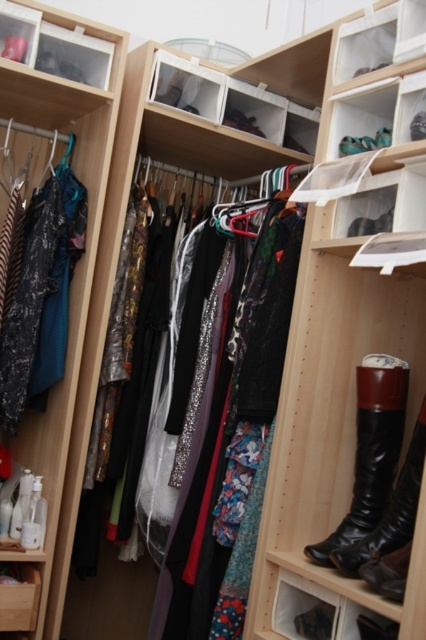
Question: Is black leather boot at right to the left of floral fabric dress at center from the viewer's perspective?

Choices:
 (A) no
 (B) yes

Answer: (A)

Question: Which point is farther to the camera?

Choices:
 (A) (189, 573)
 (B) (371, 460)
 (C) (0, 596)

Answer: (A)

Question: Which point is farther from the camera taking this photo?

Choices:
 (A) (92, 76)
 (B) (19, 595)
 (C) (379, 416)
 (D) (169, 584)

Answer: (A)

Question: Does black leather boot at right lie in front of wooden drawer at lower left?

Choices:
 (A) yes
 (B) no

Answer: (A)

Question: Does black leather boot at right have a lesser width compared to wooden drawer at lower left?

Choices:
 (A) no
 (B) yes

Answer: (A)

Question: Which object is closer to the camera taking this photo?

Choices:
 (A) black leather boot at right
 (B) wooden drawer at lower left
 (C) floral fabric dress at center

Answer: (A)